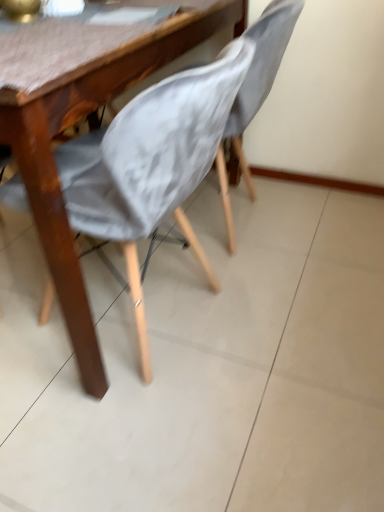
Question: Should I look upward or downward to see matte gray fabric chair at center, which ranks as the 1th chair in left-to-right order?

Choices:
 (A) up
 (B) down

Answer: (A)

Question: Is matte gray fabric chair at center, which ranks as the 1th chair in left-to-right order, closer to camera compared to gray fabric chair at center, the 1th chair when ordered from right to left?

Choices:
 (A) no
 (B) yes

Answer: (B)

Question: Is matte gray fabric chair at center, the 2th chair when ordered from right to left, touching gray fabric chair at center, the 1th chair when ordered from right to left?

Choices:
 (A) no
 (B) yes

Answer: (A)

Question: From the image's perspective, is matte gray fabric chair at center, which ranks as the 1th chair in left-to-right order, on gray fabric chair at center, the 1th chair when ordered from right to left?

Choices:
 (A) yes
 (B) no

Answer: (B)

Question: Can you confirm if matte gray fabric chair at center, which ranks as the 1th chair in left-to-right order, is taller than gray fabric chair at center, the 1th chair when ordered from right to left?

Choices:
 (A) yes
 (B) no

Answer: (B)

Question: Is gray fabric chair at center, the 1th chair when ordered from right to left, completely or partially inside matte gray fabric chair at center, the 2th chair when ordered from right to left?

Choices:
 (A) no
 (B) yes

Answer: (B)

Question: Is matte gray fabric chair at center, the 2th chair when ordered from right to left, smaller than gray fabric chair at center, the 1th chair when ordered from right to left?

Choices:
 (A) yes
 (B) no

Answer: (B)

Question: From a real-world perspective, is gray fabric chair at center, arranged as the second chair when viewed from the left, below matte gray fabric chair at center, the 2th chair when ordered from right to left?

Choices:
 (A) no
 (B) yes

Answer: (A)

Question: Is gray fabric chair at center, arranged as the second chair when viewed from the left, outside of matte gray fabric chair at center, which ranks as the 1th chair in left-to-right order?

Choices:
 (A) yes
 (B) no

Answer: (B)

Question: Is gray fabric chair at center, the 1th chair when ordered from right to left, beside matte gray fabric chair at center, which ranks as the 1th chair in left-to-right order?

Choices:
 (A) yes
 (B) no

Answer: (B)

Question: From the image's perspective, is gray fabric chair at center, arranged as the second chair when viewed from the left, over matte gray fabric chair at center, the 2th chair when ordered from right to left?

Choices:
 (A) yes
 (B) no

Answer: (A)

Question: From a real-world perspective, is gray fabric chair at center, arranged as the second chair when viewed from the left, positioned over matte gray fabric chair at center, which ranks as the 1th chair in left-to-right order, based on gravity?

Choices:
 (A) no
 (B) yes

Answer: (B)

Question: Is gray fabric chair at center, the 1th chair when ordered from right to left, oriented away from matte gray fabric chair at center, the 2th chair when ordered from right to left?

Choices:
 (A) yes
 (B) no

Answer: (A)

Question: Considering the positions of gray fabric chair at center, the 1th chair when ordered from right to left, and matte gray fabric chair at center, the 2th chair when ordered from right to left, in the image, is gray fabric chair at center, the 1th chair when ordered from right to left, taller or shorter than matte gray fabric chair at center, the 2th chair when ordered from right to left,?

Choices:
 (A) short
 (B) tall

Answer: (B)